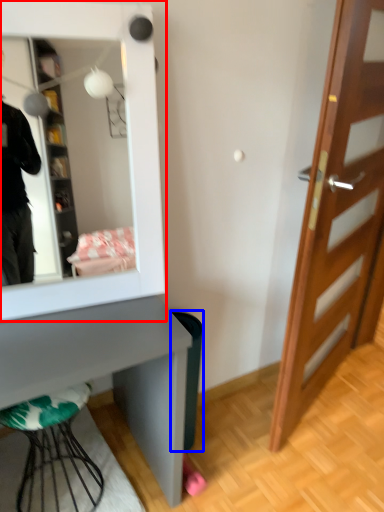
Question: Which of the following is the closest to the observer, mirror (highlighted by a red box) or trash bin/can (highlighted by a blue box)?

Choices:
 (A) mirror
 (B) trash bin/can

Answer: (A)